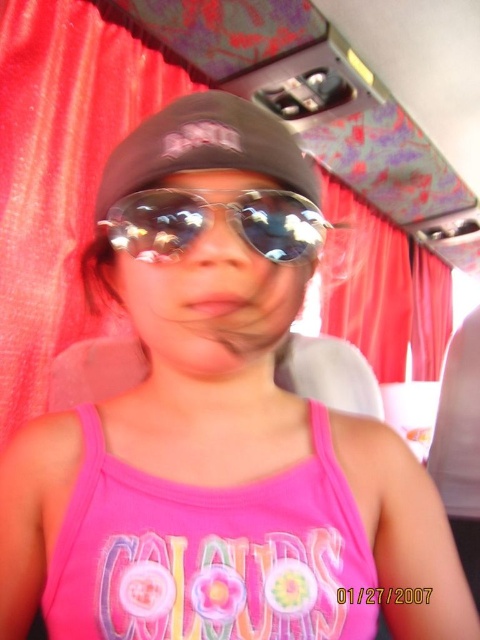
Question: Is the position of matte black baseball cap at center less distant than that of shiny reflective sunglasses at center?

Choices:
 (A) yes
 (B) no

Answer: (A)

Question: Which of the following is the closest to the observer?

Choices:
 (A) shiny reflective sunglasses at center
 (B) matte black baseball cap at center

Answer: (B)

Question: Can you confirm if matte black baseball cap at center is thinner than shiny reflective sunglasses at center?

Choices:
 (A) no
 (B) yes

Answer: (A)

Question: Observing the image, what is the correct spatial positioning of matte black baseball cap at center in reference to shiny reflective sunglasses at center?

Choices:
 (A) above
 (B) below

Answer: (A)